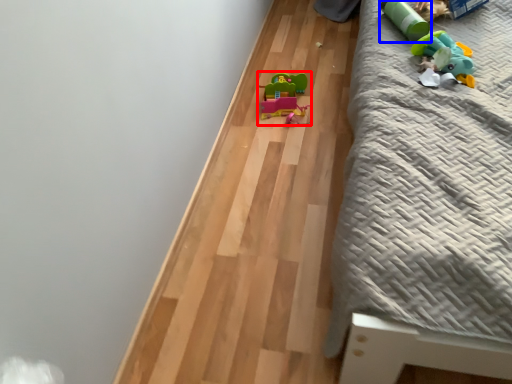
Question: Which object is further to the camera taking this photo, toy (highlighted by a red box) or toy (highlighted by a blue box)?

Choices:
 (A) toy
 (B) toy

Answer: (A)